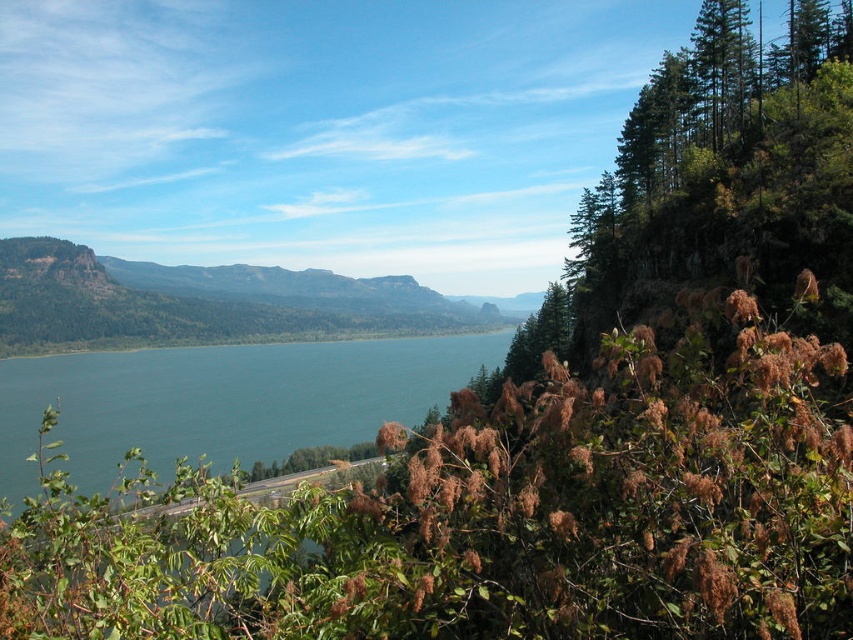
You are standing at the edge of the cliff overlooking the river valley. You notice the blue water at center in the distance. If you were to mark its exact location on a map using coordinates, what would they be?

The blue water at center is located at coordinates point (x=222, y=401).

You are a hiker standing on the cliff edge overlooking the valley. You see the blue water at center and the green forested mountain at center. Which one is positioned lower in the scene?

The blue water at center is located below the green forested mountain at center, so the blue water at center is positioned lower in the scene.

You are standing at the point marked as point (x=222, y=401). What color is the water at the center of the image?

The blue water at center is located at point (x=222, y=401), so the water at the center is blue.